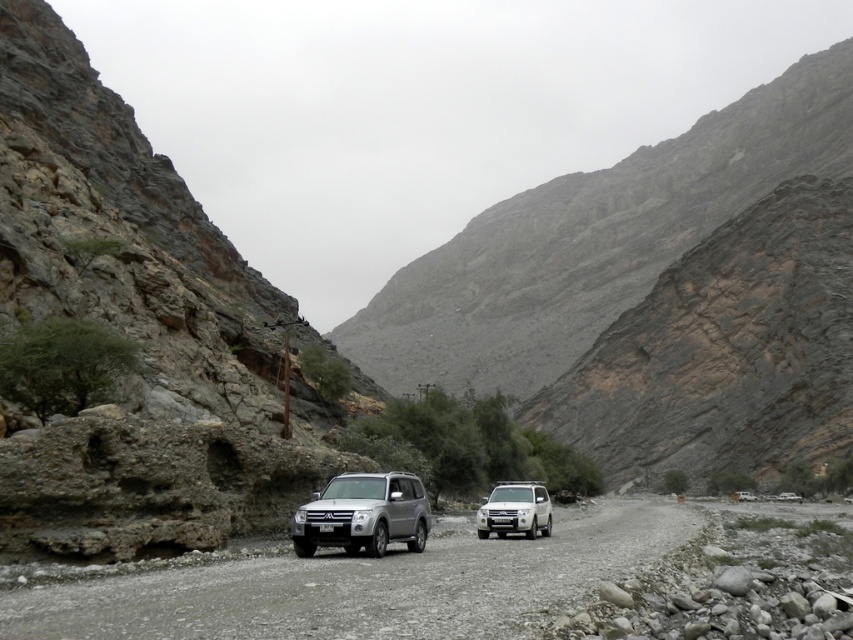
You are a driver navigating a mountain road with steep cliffs on both sides. You see a silver metallic suv at center. Based on its 2D location coordinates, can you estimate whether the suv is positioned closer to the left or right side of the road?

The silver metallic suv at center is positioned at point 0.805 on the x axis, which is closer to the right side of the road since the coordinate system typically places 0 on the left and 1 on the right.

Consider the image. You are a delivery drone operator trying to navigate through the narrow mountain road between the two cliffs. You need to know if your drone, which is 1.2 meters tall, can pass under the silver metallic suv at center without hitting the black plastic license plate at center. Can it?

The silver metallic suv at center has a greater height compared to the black plastic license plate at center. Since the license plate is lower, the drone at 1.2 meters tall might clear it, but the SUV itself is taller. The drone would need to ensure it can pass under the SUV, not just the license plate. However, the description only states the SUV is taller than the license plate, but doesn

You are navigating a silver metallic jeep at center on a rugged mountain road surrounded by steep cliffs. What is the safest direction to proceed, considering the vehicle is at point 0.798, 0.605?

The silver metallic jeep at center is located at point (515, 509), so the safest direction would be to follow the gravel road away from the steep cliffs on both sides to avoid potential hazards like rockfalls or unstable terrain.